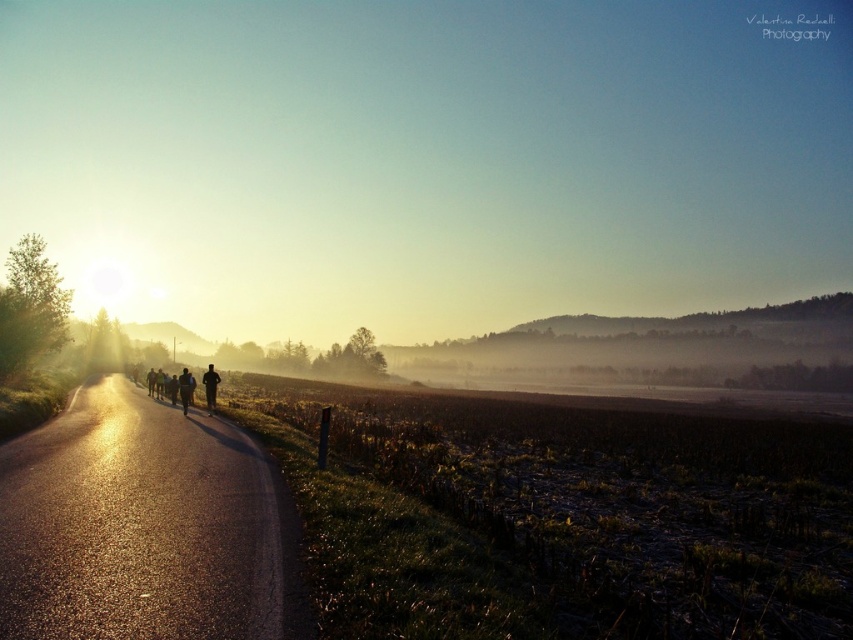
Question: Is matte asphalt road at left below dark blue running suit at center?

Choices:
 (A) no
 (B) yes

Answer: (A)

Question: Which point is closer to the camera taking this photo?

Choices:
 (A) (282, 600)
 (B) (410, 109)
 (C) (190, 396)

Answer: (A)

Question: Among these objects, which one is farthest from the camera?

Choices:
 (A) silhouette running at left
 (B) matte asphalt road at left
 (C) asphalt road at center

Answer: (B)

Question: Where is matte asphalt road at left located in relation to silhouette running at left in the image?

Choices:
 (A) right
 (B) left

Answer: (A)

Question: Is asphalt road at center thinner than dark blue running suit at center?

Choices:
 (A) no
 (B) yes

Answer: (A)

Question: Which point is farther to the camera?

Choices:
 (A) (430, 209)
 (B) (161, 372)

Answer: (A)